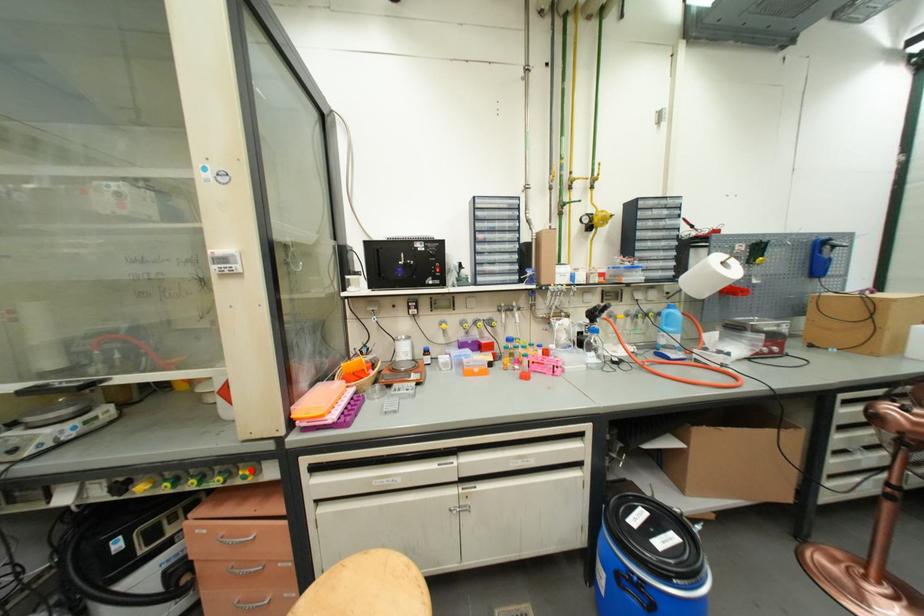
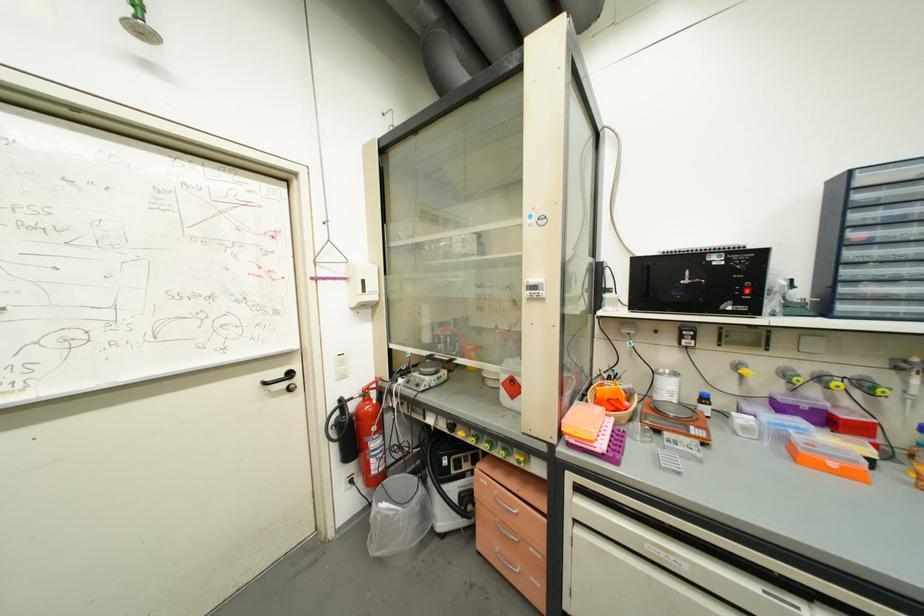
Question: I am providing you with two images of the same scene from different viewpoints. A red point is marked on the first image. Can you still see the location of the red point in image 2?

Choices:
 (A) Yes
 (B) No

Answer: (A)